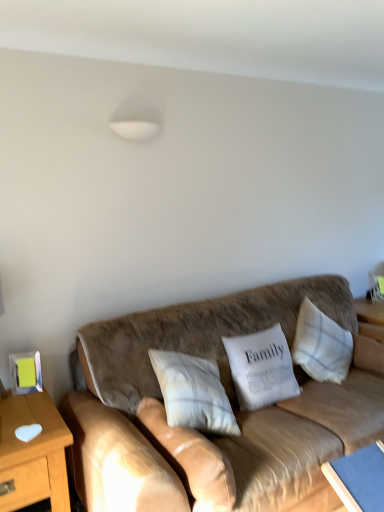
Question: Is brown leather couch at center completely or partially outside of white fabric pillow at center, arranged as the third pillow when viewed from the left?

Choices:
 (A) no
 (B) yes

Answer: (B)

Question: Can you confirm if brown leather couch at center is thinner than white fabric pillow at center, arranged as the third pillow when viewed from the left?

Choices:
 (A) yes
 (B) no

Answer: (B)

Question: Is brown leather couch at center closer to camera compared to white fabric pillow at center, arranged as the third pillow when viewed from the left?

Choices:
 (A) yes
 (B) no

Answer: (A)

Question: Can you confirm if brown leather couch at center is taller than white fabric pillow at center, arranged as the third pillow when viewed from the left?

Choices:
 (A) no
 (B) yes

Answer: (B)

Question: Is brown leather couch at center positioned behind white fabric pillow at center, which ranks as the 2th pillow in right-to-left order?

Choices:
 (A) yes
 (B) no

Answer: (B)

Question: Considering the positions of point (195, 445) and point (139, 394), is point (195, 445) closer or farther from the camera than point (139, 394)?

Choices:
 (A) closer
 (B) farther

Answer: (A)

Question: Considering their positions, is white textured pillow at center, arranged as the 1th pillow when viewed from the left, located in front of or behind brown leather couch at center?

Choices:
 (A) behind
 (B) front

Answer: (A)

Question: Is white textured pillow at center, arranged as the 1th pillow when viewed from the left, situated inside brown leather couch at center or outside?

Choices:
 (A) outside
 (B) inside

Answer: (B)

Question: From the image's perspective, is white textured pillow at center, arranged as the 1th pillow when viewed from the left, located above or below brown leather couch at center?

Choices:
 (A) above
 (B) below

Answer: (B)

Question: From their relative heights in the image, would you say white textured pillow at right, the fourth pillow when ordered from left to right, is taller or shorter than white fabric pillow at center, which ranks as the 2th pillow in right-to-left order?

Choices:
 (A) tall
 (B) short

Answer: (A)

Question: Is point (331, 329) closer or farther from the camera than point (279, 368)?

Choices:
 (A) closer
 (B) farther

Answer: (B)

Question: In terms of width, does white textured pillow at right, the fourth pillow when ordered from left to right, look wider or thinner when compared to white fabric pillow at center, which ranks as the 2th pillow in right-to-left order?

Choices:
 (A) thin
 (B) wide

Answer: (B)

Question: Choose the correct answer: Is white textured pillow at right, which is the 1th pillow in right-to-left order, inside white fabric pillow at center, which ranks as the 2th pillow in right-to-left order, or outside it?

Choices:
 (A) inside
 (B) outside

Answer: (B)

Question: Relative to white textured pillow at center, which is the 4th pillow in right-to-left order, is wooden table at left, the first table when ordered from left to right, in front or behind?

Choices:
 (A) behind
 (B) front

Answer: (A)

Question: Is wooden table at left, the 2th table when ordered from right to left, bigger or smaller than white textured pillow at center, which is the 4th pillow in right-to-left order?

Choices:
 (A) small
 (B) big

Answer: (B)